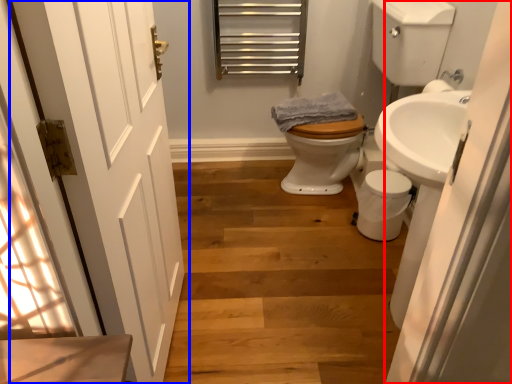
Question: Which object appears farthest to the camera in this image, screen door (highlighted by a red box) or door (highlighted by a blue box)?

Choices:
 (A) screen door
 (B) door

Answer: (A)